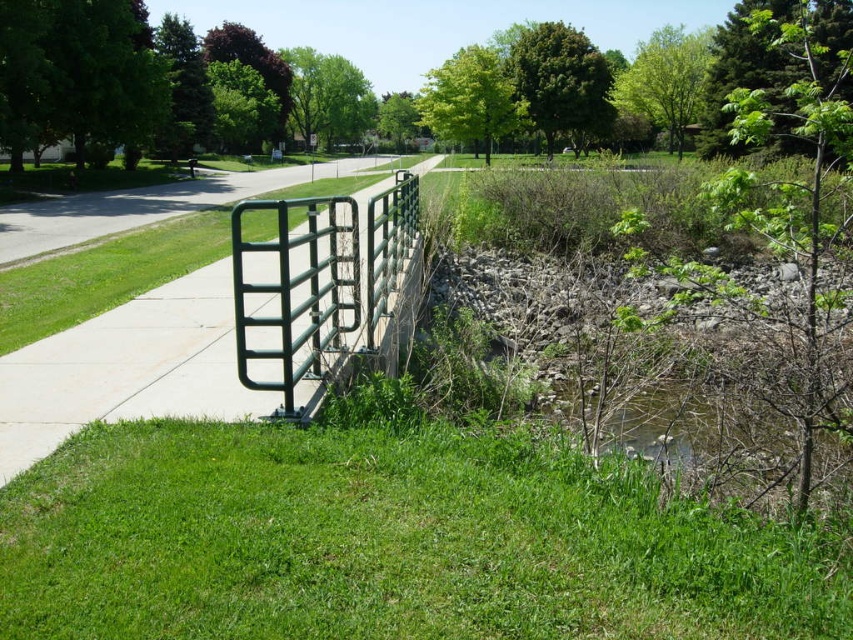
Question: Which object appears farthest from the camera in this image?

Choices:
 (A) green grass at lower center
 (B) green metal fence at center

Answer: (B)

Question: Estimate the real-world distances between objects in this image. Which object is farther from the green metal fence at center?

Choices:
 (A) green matte metal gate at center
 (B) green grass at lower center

Answer: (B)

Question: Does green metal fence at center appear over green matte metal gate at center?

Choices:
 (A) yes
 (B) no

Answer: (A)

Question: Can you confirm if green grass at lower center is bigger than green metal fence at center?

Choices:
 (A) yes
 (B) no

Answer: (B)

Question: Which object appears farthest from the camera in this image?

Choices:
 (A) green matte metal gate at center
 (B) green grass at lower center

Answer: (A)

Question: Does green grass at lower center appear under green metal fence at center?

Choices:
 (A) no
 (B) yes

Answer: (B)